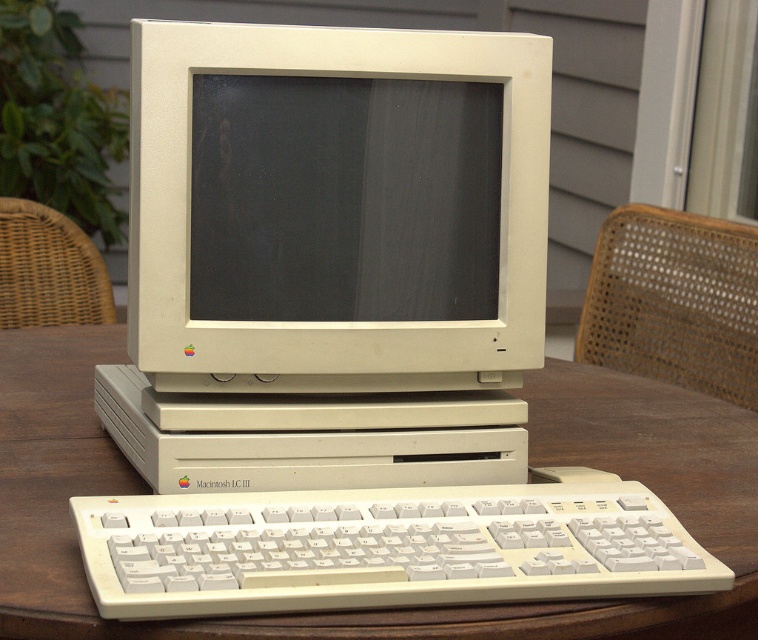
Question: Based on their relative distances, which object is nearer to the wooden table at center?

Choices:
 (A) black matte screen at center
 (B) white plastic monitor at center
 (C) white plastic keyboard at center

Answer: (C)

Question: Is white plastic monitor at center wider than white plastic keyboard at center?

Choices:
 (A) yes
 (B) no

Answer: (B)

Question: Considering the real-world distances, which object is closest to the white plastic monitor at center?

Choices:
 (A) black matte screen at center
 (B) wooden table at center
 (C) white plastic keyboard at center

Answer: (A)

Question: In this image, where is wooden table at center located relative to black matte screen at center?

Choices:
 (A) right
 (B) left

Answer: (B)

Question: Which object is the farthest from the white plastic monitor at center?

Choices:
 (A) wooden table at center
 (B) black matte screen at center

Answer: (A)

Question: Does wooden table at center come in front of black matte screen at center?

Choices:
 (A) yes
 (B) no

Answer: (A)